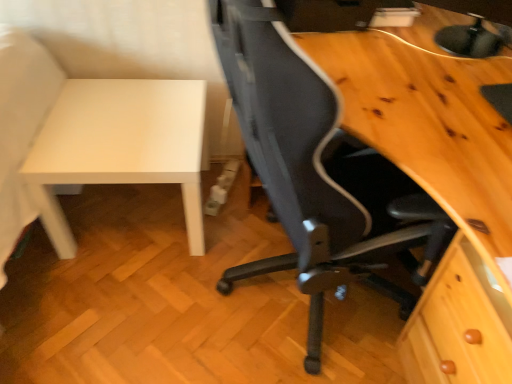
Identify the location of vacant space behind matte black monitor at upper right. This screenshot has width=512, height=384. tap(434, 25).